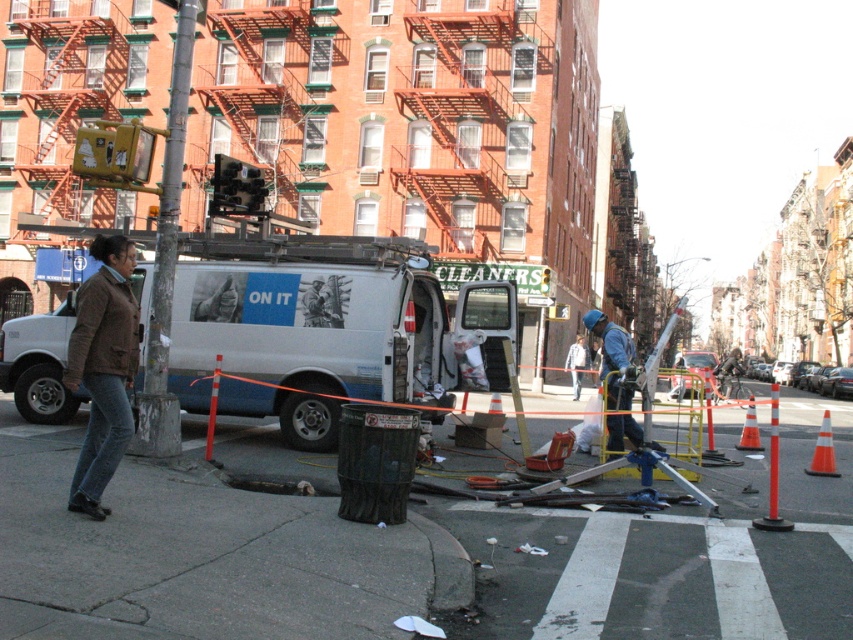
You are a delivery person standing on the concrete sidewalk at lower left and need to pick up the brown woolen jacket at lower left. Can you reach the jacket without stepping off the sidewalk?

The concrete sidewalk at lower left is located below the brown woolen jacket at lower left, so you can reach the jacket while staying on the sidewalk.

You are standing on the sidewalk in front of the white matte van at center. You want to walk to the nearest building entrance, which is 15 meters away from you. Can you reach the entrance without walking past the van?

The white matte van at center is 11.72 meters from the viewer. Since the entrance is 15 meters away, you can reach it without walking past the van because the van is closer to you than the entrance.

You are standing on the concrete sidewalk at lower left. What is the exact coordinate of your current position?

The concrete sidewalk at lower left is located at point (405, 552).